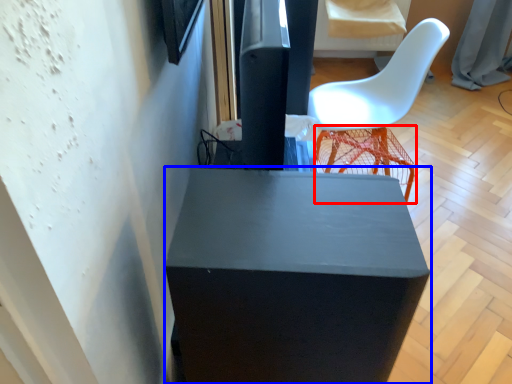
Question: Which point is closer to the camera, bar stool (highlighted by a red box) or furniture (highlighted by a blue box)?

Choices:
 (A) bar stool
 (B) furniture

Answer: (B)